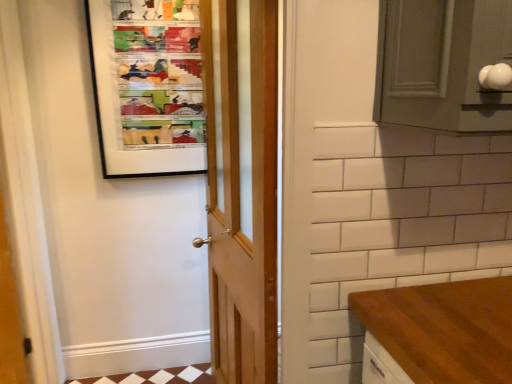
Question: Is wooden door at center in front of or behind matte plastic bulletin board at upper left in the image?

Choices:
 (A) front
 (B) behind

Answer: (A)

Question: From the image's perspective, is wooden door at center positioned above or below matte plastic bulletin board at upper left?

Choices:
 (A) above
 (B) below

Answer: (B)

Question: Does point (245, 284) appear closer or farther from the camera than point (165, 16)?

Choices:
 (A) closer
 (B) farther

Answer: (A)

Question: Based on their positions, is matte plastic bulletin board at upper left located to the left or right of wooden door at center?

Choices:
 (A) left
 (B) right

Answer: (A)

Question: In terms of width, does matte plastic bulletin board at upper left look wider or thinner when compared to wooden door at center?

Choices:
 (A) thin
 (B) wide

Answer: (A)

Question: Choose the correct answer: Is matte plastic bulletin board at upper left inside wooden door at center or outside it?

Choices:
 (A) inside
 (B) outside

Answer: (B)

Question: Relative to wooden door at center, is matte plastic bulletin board at upper left in front or behind?

Choices:
 (A) behind
 (B) front

Answer: (A)